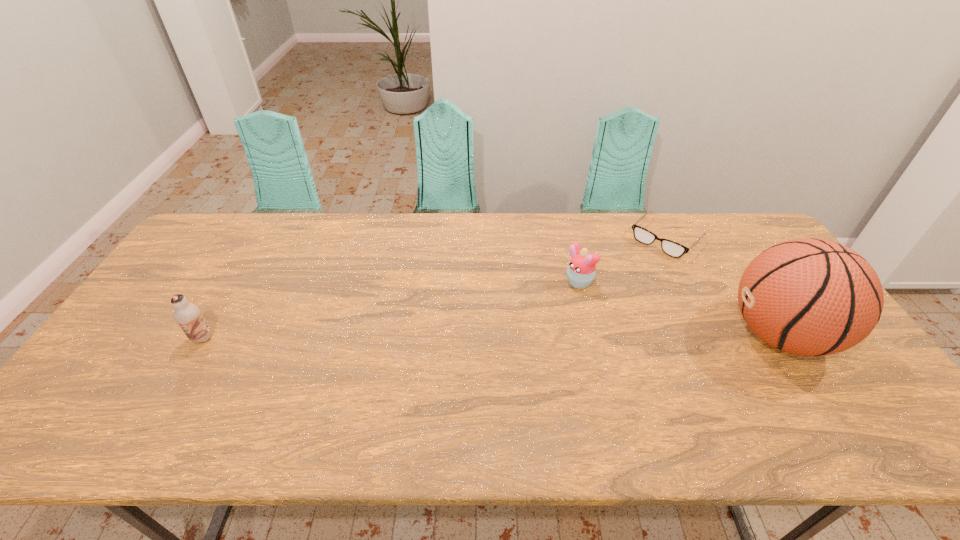
You are a GUI agent. You are given a task and a screenshot of the screen. Output one action in this format:
    pyautogui.click(x=<x>, y=<y>)
    Task: Click on the vacant area that lies between the shortest object and the basketball
    
    Given the screenshot: What is the action you would take?
    pyautogui.click(x=723, y=287)

This screenshot has height=540, width=960. What are the coordinates of `free space between the cupcake and the spectacles` in the screenshot? It's located at (622, 261).

Find the location of a particular element. The height and width of the screenshot is (540, 960). vacant space that's between the spectacles and the leftmost object is located at coordinates tap(434, 288).

Find the location of a particular element. vacant area between the farthest object and the basketball is located at coordinates (723, 287).

Where is `vacant area that lies between the chocolate milk and the spectacles`? This screenshot has height=540, width=960. vacant area that lies between the chocolate milk and the spectacles is located at coordinates tap(434, 288).

You are a GUI agent. You are given a task and a screenshot of the screen. Output one action in this format:
    pyautogui.click(x=<x>, y=<y>)
    Task: Click on the vacant point located between the farthest object and the tallest object
    Image resolution: width=960 pixels, height=540 pixels.
    Given the screenshot: What is the action you would take?
    pyautogui.click(x=723, y=287)

The image size is (960, 540). I want to click on object that stands as the second closest to the third object from right to left, so click(810, 297).

Locate an element on the screen. The image size is (960, 540). object that is the second closest to the basketball is located at coordinates (581, 271).

In order to click on vacant space that satisfies the following two spatial constraints: 1. on the back side of the chocolate milk; 2. on the side where the inflation valve is located in this screenshot , I will do `click(204, 335)`.

I want to click on free location that satisfies the following two spatial constraints: 1. on the back side of the chocolate milk; 2. on the left side of the shortest object, so click(x=261, y=238).